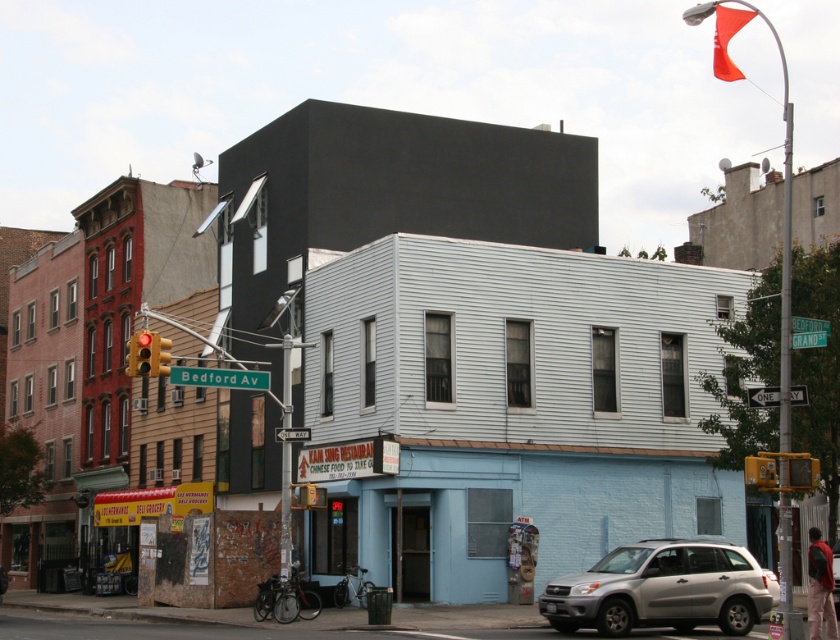
You are a delivery driver needing to park your silver metallic suv at lower right near the two story light blue and white building. Based on its current position at point 0.922, 0.787, can you estimate if it will fit without moving further left or forward?

The silver metallic suv at lower right is located at point (660, 589). Since the coordinates are close to the lower right corner, there might not be enough space to park without adjusting its position. It is recommended to move the vehicle slightly left or forward to ensure proper parking alignment.